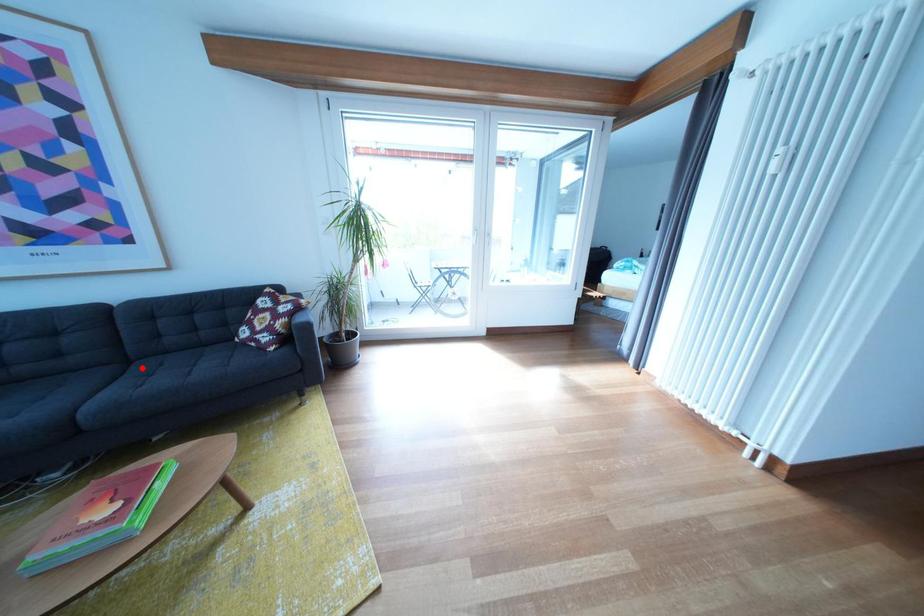
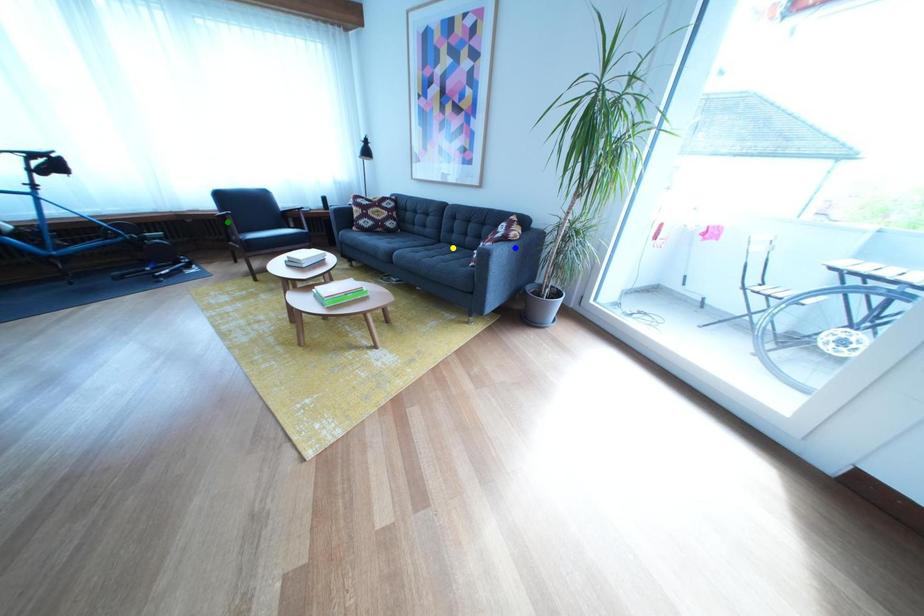
Question: I am providing you with two images of the same scene from different viewpoints. A red point is marked on the first image. You are given multiple points on the second image. Which point in image 2 represents the same 3d spot as the red point in image 1?

Choices:
 (A) yellow point
 (B) green point
 (C) blue point

Answer: (A)